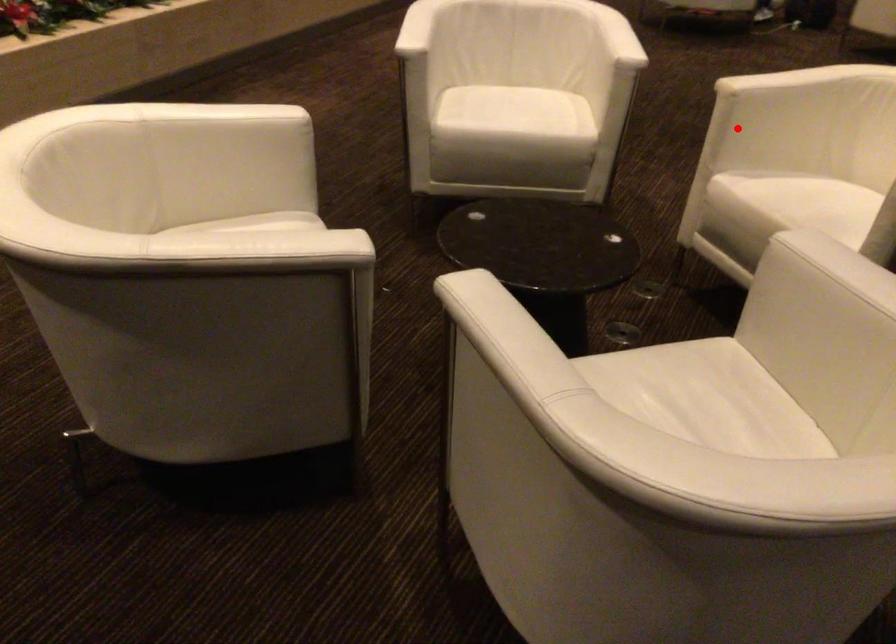
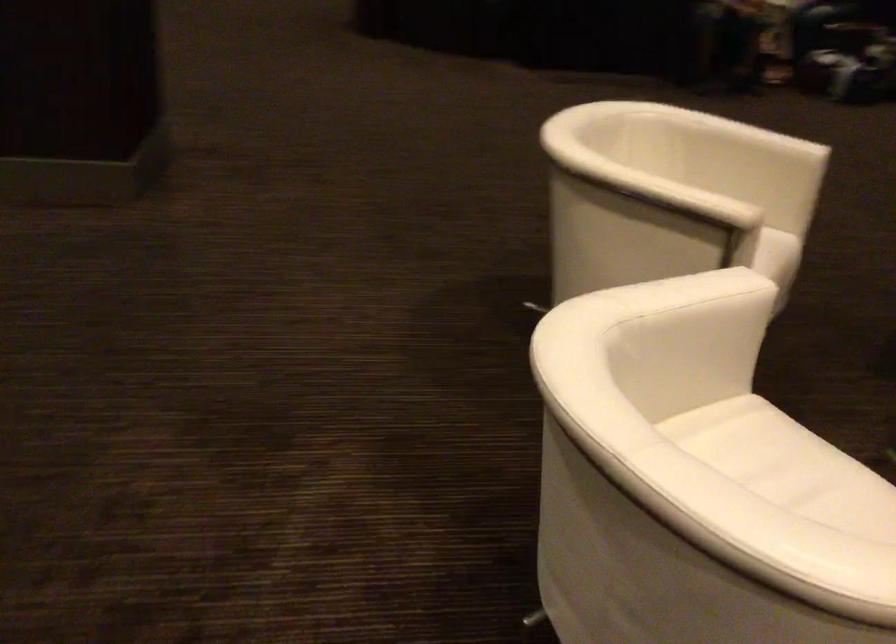
In the second image, find the point that corresponds to the highlighted location in the first image.

(676, 261)